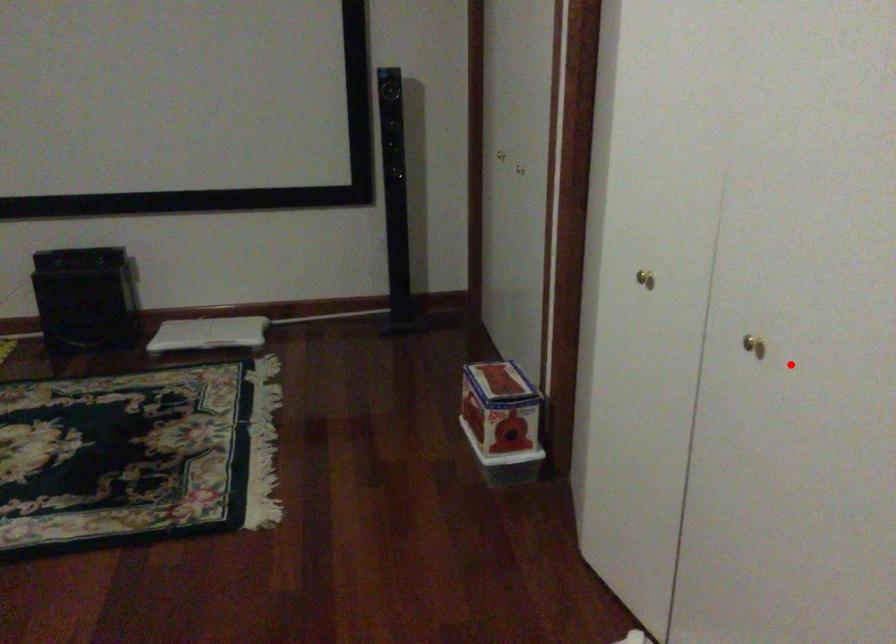
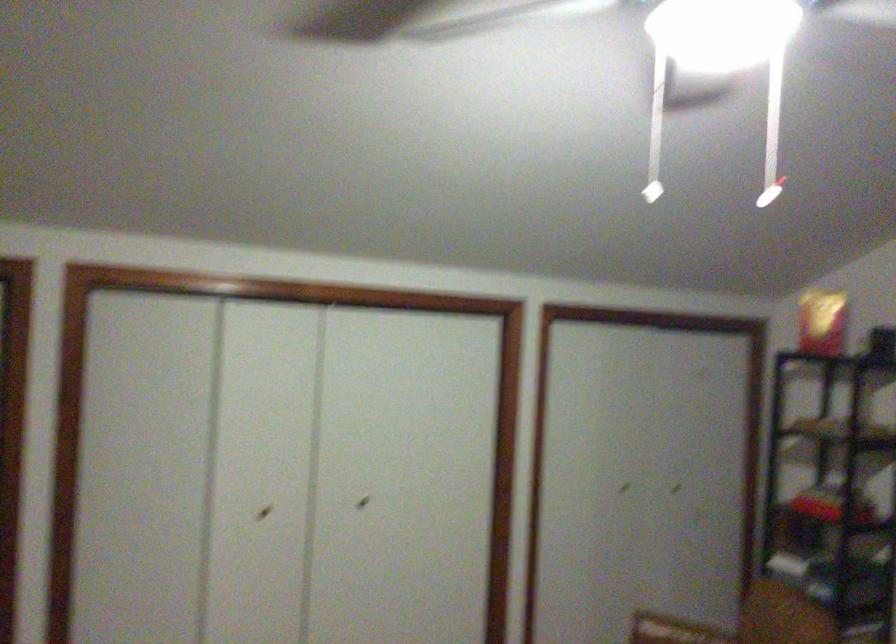
Locate, in the second image, the point that corresponds to the highlighted location in the first image.

(363, 502)